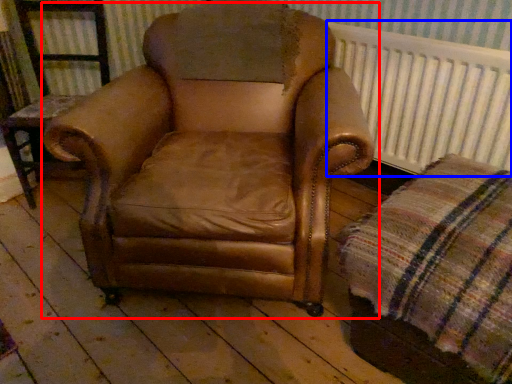
Question: Which point is further to the camera, chair (highlighted by a red box) or radiator (highlighted by a blue box)?

Choices:
 (A) chair
 (B) radiator

Answer: (B)